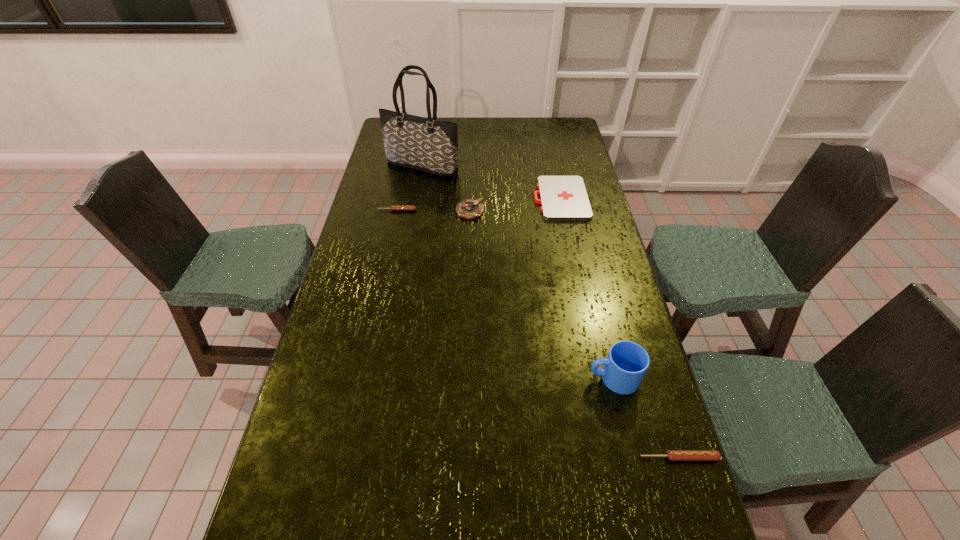
This screenshot has height=540, width=960. I want to click on empty space that is in between the fifth shortest object and the shortest object, so click(x=588, y=288).

Locate an element on the screen. vacant space that's between the first-aid kit and the farthest object is located at coordinates (492, 183).

You are a GUI agent. You are given a task and a screenshot of the screen. Output one action in this format:
    pyautogui.click(x=<x>, y=<y>)
    Task: Click on the empty location between the tote bag and the mug
    The width and height of the screenshot is (960, 540).
    Given the screenshot: What is the action you would take?
    pyautogui.click(x=517, y=273)

The width and height of the screenshot is (960, 540). I want to click on vacant area between the first-aid kit and the fifth shortest object, so click(x=588, y=288).

Where is `free space that is in between the mug and the shorter sausage`? free space that is in between the mug and the shorter sausage is located at coordinates (505, 294).

Locate an element on the screen. The width and height of the screenshot is (960, 540). blank region between the fifth farthest object and the tallest object is located at coordinates point(517,273).

Where is `vacant space that's between the shortest object and the farthest object`? Image resolution: width=960 pixels, height=540 pixels. vacant space that's between the shortest object and the farthest object is located at coordinates (492, 183).

The image size is (960, 540). I want to click on vacant space in between the shortest object and the third tallest object, so click(516, 205).

You are a GUI agent. You are given a task and a screenshot of the screen. Output one action in this format:
    pyautogui.click(x=<x>, y=<y>)
    Task: Click on the vacant space that's between the ashtray and the farthest object
    Image resolution: width=960 pixels, height=540 pixels.
    Given the screenshot: What is the action you would take?
    pyautogui.click(x=446, y=189)

Identify which object is the third closest to the fifth farthest object. Please provide its 2D coordinates. Your answer should be formatted as a tuple, i.e. [(x, y)], where the tuple contains the x and y coordinates of a point satisfying the conditions above.

[(470, 209)]